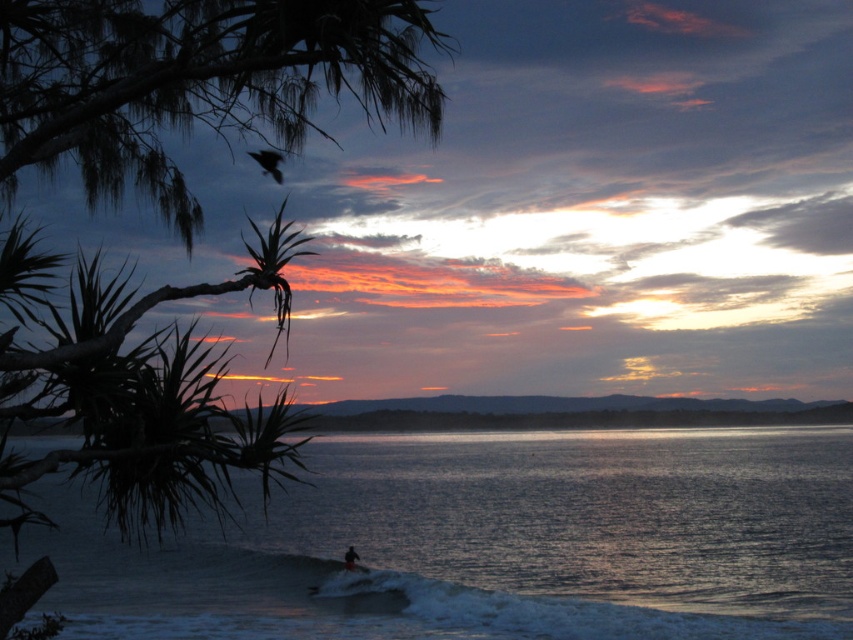
Based on the photo, you are standing at the point marked by the coordinates point (x=497, y=541) in the image. What do you see around you?

You are standing in clear water at center, as indicated by the coordinates point (x=497, y=541).

You are a photographer planning to capture the sunset scene. You want to ensure both the green leafy tree at upper left and the white foam surfboard at lower center are in focus. Which object should you focus on first to ensure both are sharp?

You should focus on the green leafy tree at upper left first because it is closer to the viewer than the white foam surfboard at lower center, ensuring both will be in focus when using depth of field techniques.

You are standing at the point marked as point (497, 541) in the image. Based on the scene description, what is the immediate surface beneath your feet?

The immediate surface beneath your feet at point (497, 541) is clear water at center, as the point is located on clear water at center.